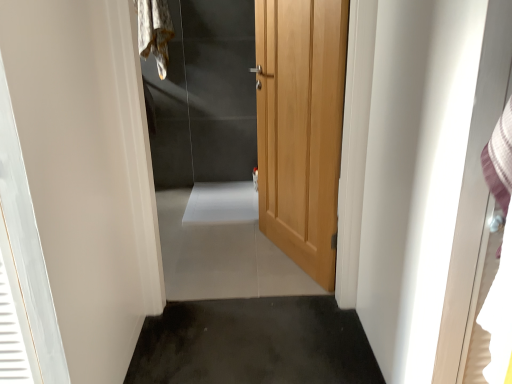
Identify the location of fuzzy fabric laundry at upper left. (154, 31).

In order to face fuzzy fabric laundry at upper left, should I rotate leftwards or rightwards?

It's best to rotate left around 13.379 degrees.

You are a GUI agent. You are given a task and a screenshot of the screen. Output one action in this format:
    pyautogui.click(x=<x>, y=<y>)
    Task: Click on the white glossy screen door at right
    
    Given the screenshot: What is the action you would take?
    pyautogui.click(x=474, y=196)

This screenshot has height=384, width=512. Describe the element at coordinates (205, 96) in the screenshot. I see `wooden door at center` at that location.

The image size is (512, 384). What are the coordinates of `light wood door at center` in the screenshot? It's located at (301, 127).

What's the angular difference between dark gray concrete at lower center and wooden door at center's facing directions?

dark gray concrete at lower center and wooden door at center are facing 89.7 degrees away from each other.

Who is smaller, dark gray concrete at lower center or wooden door at center?

dark gray concrete at lower center.

Is dark gray concrete at lower center positioned beyond the bounds of wooden door at center?

Yes, dark gray concrete at lower center is located beyond the bounds of wooden door at center.

Is there a large distance between dark gray concrete at lower center and wooden door at center?

That's right, there is a large distance between dark gray concrete at lower center and wooden door at center.

From the picture: From the image's perspective, is fuzzy fabric laundry at upper left on top of dark gray concrete at lower center?

Yes, from the image's perspective, fuzzy fabric laundry at upper left is on top of dark gray concrete at lower center.

Is point (163, 26) farther from camera compared to point (373, 374)?

Yes, point (163, 26) is farther from viewer.

From the picture: What's the angular difference between fuzzy fabric laundry at upper left and dark gray concrete at lower center's facing directions?

fuzzy fabric laundry at upper left and dark gray concrete at lower center are facing 90.2 degrees away from each other.

Are fuzzy fabric laundry at upper left and dark gray concrete at lower center beside each other?

No, fuzzy fabric laundry at upper left is not next to dark gray concrete at lower center.

Does point (317, 195) lie behind point (175, 302)?

Yes, point (317, 195) is behind point (175, 302).

Is light wood door at center oriented away from dark gray concrete at lower center?

No.

Consider the image. Between light wood door at center and dark gray concrete at lower center, which one has smaller size?

dark gray concrete at lower center is smaller.

Can you confirm if light wood door at center is thinner than dark gray concrete at lower center?

Correct, the width of light wood door at center is less than that of dark gray concrete at lower center.

Does fuzzy fabric laundry at upper left turn towards wooden door at center?

No, fuzzy fabric laundry at upper left is not aimed at wooden door at center.

Which of these two, fuzzy fabric laundry at upper left or wooden door at center, is bigger?

Bigger between the two is wooden door at center.

Do you think fuzzy fabric laundry at upper left is within wooden door at center, or outside of it?

fuzzy fabric laundry at upper left cannot be found inside wooden door at center.

Which is more to the right, fuzzy fabric laundry at upper left or wooden door at center?

From the viewer's perspective, wooden door at center appears more on the right side.

Looking at this image, can you confirm if wooden door at center is positioned to the left of dark gray concrete at lower center?

Correct, you'll find wooden door at center to the left of dark gray concrete at lower center.

Is wooden door at center positioned behind dark gray concrete at lower center?

That is True.

Is point (240, 22) in front of point (243, 322)?

No.

What are the coordinates of `elevator to the left of dark gray concrete at lower center` in the screenshot? It's located at coord(205,96).

The image size is (512, 384). What are the coordinates of `screen door on the right of fuzzy fabric laundry at upper left` in the screenshot? It's located at (474, 196).

Can you confirm if white glossy screen door at right is shorter than fuzzy fabric laundry at upper left?

No.

Considering the points (474, 178) and (157, 2), which point is in front, point (474, 178) or point (157, 2)?

The point (474, 178) is closer.

Is white glossy screen door at right outside of fuzzy fabric laundry at upper left?

A: Yes, white glossy screen door at right is outside of fuzzy fabric laundry at upper left.

Could you tell me if dark gray concrete at lower center is turned towards fuzzy fabric laundry at upper left?

No, dark gray concrete at lower center is not turned towards fuzzy fabric laundry at upper left.

How distant is dark gray concrete at lower center from fuzzy fabric laundry at upper left?

7.44 feet.

From the image's perspective, which is below, dark gray concrete at lower center or fuzzy fabric laundry at upper left?

From the image's view, dark gray concrete at lower center is below.

Is dark gray concrete at lower center positioned before fuzzy fabric laundry at upper left?

Yes.

At what (x,y) coordinates should I click in order to perform the action: click on concrete in front of the wooden door at center. Please return your answer as a coordinate pair (x, y). The width and height of the screenshot is (512, 384). Looking at the image, I should click on (254, 343).

The height and width of the screenshot is (384, 512). I want to click on laundry that appears on the left of dark gray concrete at lower center, so click(x=154, y=31).

Estimate the real-world distances between objects in this image. Which object is closer to fuzzy fabric laundry at upper left, light wood door at center or dark gray concrete at lower center?

light wood door at center lies closer to fuzzy fabric laundry at upper left than the other object.

Which object lies nearer to the anchor point light wood door at center, dark gray concrete at lower center or wooden door at center?

dark gray concrete at lower center is positioned closer to the anchor light wood door at center.

When comparing their distances from white glossy screen door at right, does fuzzy fabric laundry at upper left or dark gray concrete at lower center seem closer?

Based on the image, dark gray concrete at lower center appears to be nearer to white glossy screen door at right.

Estimate the real-world distances between objects in this image. Which object is further from wooden door at center, light wood door at center or fuzzy fabric laundry at upper left?

Based on the image, light wood door at center appears to be further to wooden door at center.

Which object lies further to the anchor point dark gray concrete at lower center, light wood door at center or white glossy screen door at right?

The object further to dark gray concrete at lower center is white glossy screen door at right.

Looking at the image, which one is located closer to white glossy screen door at right, dark gray concrete at lower center or fuzzy fabric laundry at upper left?

dark gray concrete at lower center is positioned closer to the anchor white glossy screen door at right.

Which object lies nearer to the anchor point light wood door at center, wooden door at center or dark gray concrete at lower center?

Among the two, dark gray concrete at lower center is located nearer to light wood door at center.

Considering their positions, is white glossy screen door at right positioned closer to wooden door at center than fuzzy fabric laundry at upper left?

fuzzy fabric laundry at upper left lies closer to wooden door at center than the other object.

The width and height of the screenshot is (512, 384). Identify the location of door positioned between white glossy screen door at right and fuzzy fabric laundry at upper left from near to far. (301, 127).

Image resolution: width=512 pixels, height=384 pixels. I want to click on door between fuzzy fabric laundry at upper left and dark gray concrete at lower center in the up-down direction, so click(x=301, y=127).

At what (x,y) coordinates should I click in order to perform the action: click on elevator between white glossy screen door at right and light wood door at center in the front-back direction. Please return your answer as a coordinate pair (x, y). Image resolution: width=512 pixels, height=384 pixels. Looking at the image, I should click on (205, 96).

You are a GUI agent. You are given a task and a screenshot of the screen. Output one action in this format:
    pyautogui.click(x=<x>, y=<y>)
    Task: Click on the elevator between light wood door at center and dark gray concrete at lower center in the vertical direction
    This screenshot has width=512, height=384.
    Given the screenshot: What is the action you would take?
    pyautogui.click(x=205, y=96)